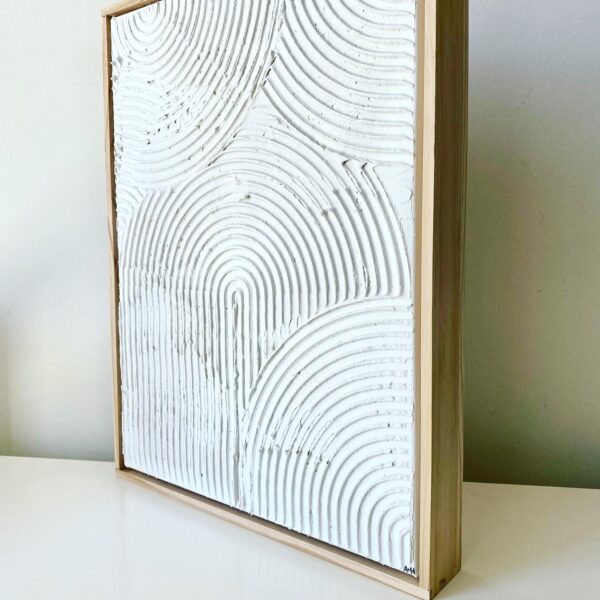
Find where shelf meets wall in the image. Your answer should be formatted as a list of tuples, i.e. [(x1, y1), (x2, y2), ...], where each tuple contains the x and y coordinates of a point satisfying the conditions above.

[(67, 457), (476, 479), (535, 482)]